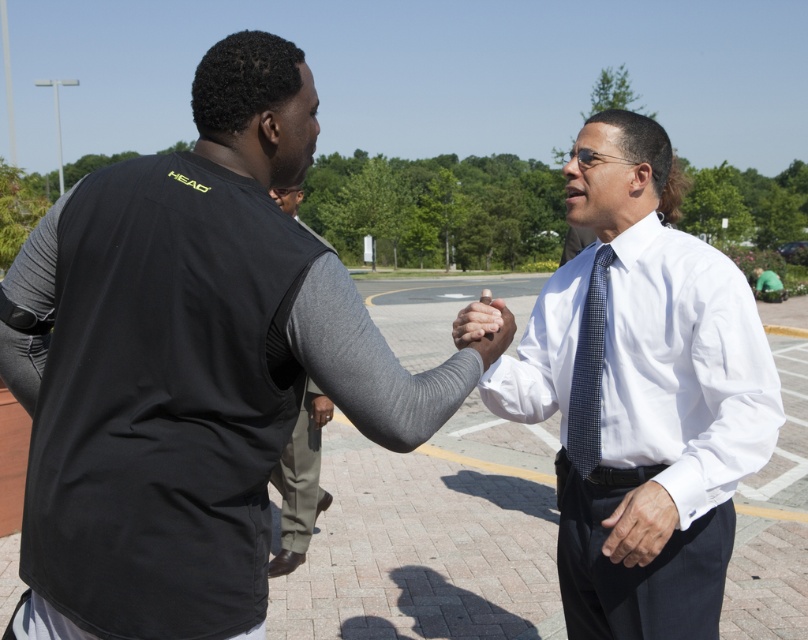
Who is positioned more to the left, white shirt at center or gray fabric sleeve at center?

gray fabric sleeve at center

Does white shirt at center appear on the left side of gray fabric sleeve at center?

No, white shirt at center is not to the left of gray fabric sleeve at center.

In the scene shown: Who is more forward, (x=623, y=300) or (x=314, y=486)?

Positioned in front is point (x=623, y=300).

You are a GUI agent. You are given a task and a screenshot of the screen. Output one action in this format:
    pyautogui.click(x=<x>, y=<y>)
    Task: Click on the white shirt at center
    This screenshot has width=808, height=640.
    Given the screenshot: What is the action you would take?
    pyautogui.click(x=642, y=394)

Based on the photo, which is below, black mesh vest at center or gray fabric sleeve at center?

gray fabric sleeve at center is below.

Who is shorter, black mesh vest at center or gray fabric sleeve at center?

With less height is gray fabric sleeve at center.

Find the location of a particular element. black mesh vest at center is located at coordinates (188, 364).

Is black mesh vest at center above blue checkered tie at center?

Indeed, black mesh vest at center is positioned over blue checkered tie at center.

Which is behind, point (259, 147) or point (600, 388)?

Positioned behind is point (600, 388).

Is point (344, 307) farther from camera compared to point (585, 385)?

That is False.

Where is `black mesh vest at center`? This screenshot has height=640, width=808. black mesh vest at center is located at coordinates (188, 364).